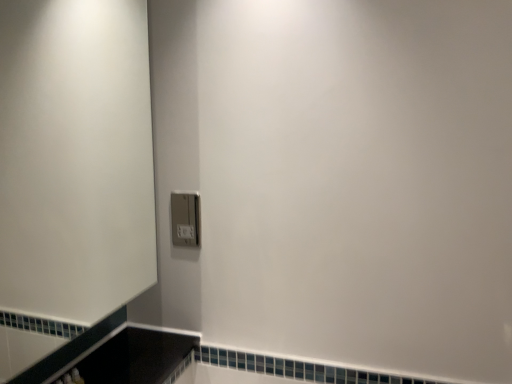
Question: Is satin silver switch at lower center positioned with its back to white matte screen door at upper left?

Choices:
 (A) no
 (B) yes

Answer: (A)

Question: Is satin silver switch at lower center at the left side of white matte screen door at upper left?

Choices:
 (A) yes
 (B) no

Answer: (B)

Question: Does satin silver switch at lower center have a lesser width compared to white matte screen door at upper left?

Choices:
 (A) yes
 (B) no

Answer: (A)

Question: From a real-world perspective, is satin silver switch at lower center located higher than white matte screen door at upper left?

Choices:
 (A) no
 (B) yes

Answer: (A)

Question: Are satin silver switch at lower center and white matte screen door at upper left located far from each other?

Choices:
 (A) yes
 (B) no

Answer: (B)

Question: Is satin silver switch at lower center next to white matte screen door at upper left and touching it?

Choices:
 (A) yes
 (B) no

Answer: (B)

Question: Is white matte screen door at upper left with satin silver switch at lower center?

Choices:
 (A) no
 (B) yes

Answer: (A)

Question: Is white matte screen door at upper left located outside satin silver switch at lower center?

Choices:
 (A) yes
 (B) no

Answer: (A)

Question: Is white matte screen door at upper left smaller than satin silver switch at lower center?

Choices:
 (A) yes
 (B) no

Answer: (B)

Question: Is satin silver switch at lower center completely or partially inside white matte screen door at upper left?

Choices:
 (A) yes
 (B) no

Answer: (B)

Question: Is white matte screen door at upper left closer to camera compared to satin silver switch at lower center?

Choices:
 (A) yes
 (B) no

Answer: (A)

Question: Is white matte screen door at upper left shorter than satin silver switch at lower center?

Choices:
 (A) no
 (B) yes

Answer: (A)

Question: From the image's perspective, is white matte screen door at upper left above or below satin silver switch at lower center?

Choices:
 (A) below
 (B) above

Answer: (B)